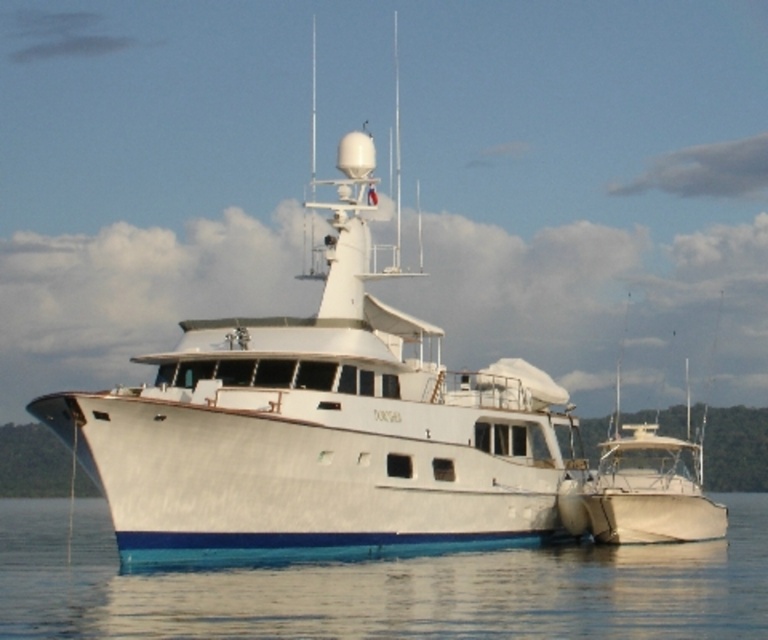
Does white glossy boat at center have a larger size compared to clear water at lower center?

Indeed, white glossy boat at center has a larger size compared to clear water at lower center.

Which is behind, point (176, 403) or point (485, 604)?

The point (176, 403) is more distant.

Find the location of a particular element. The image size is (768, 640). white glossy boat at center is located at coordinates (325, 422).